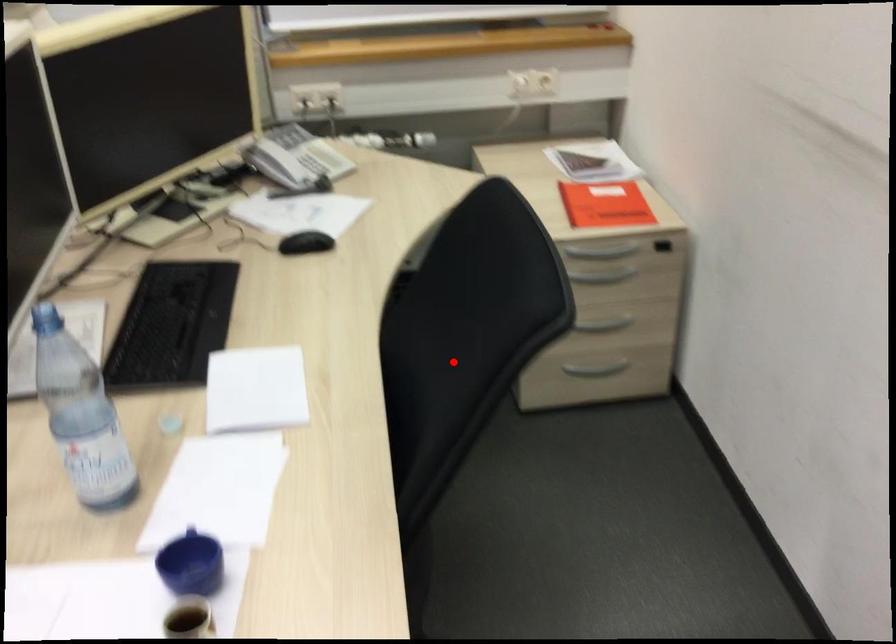
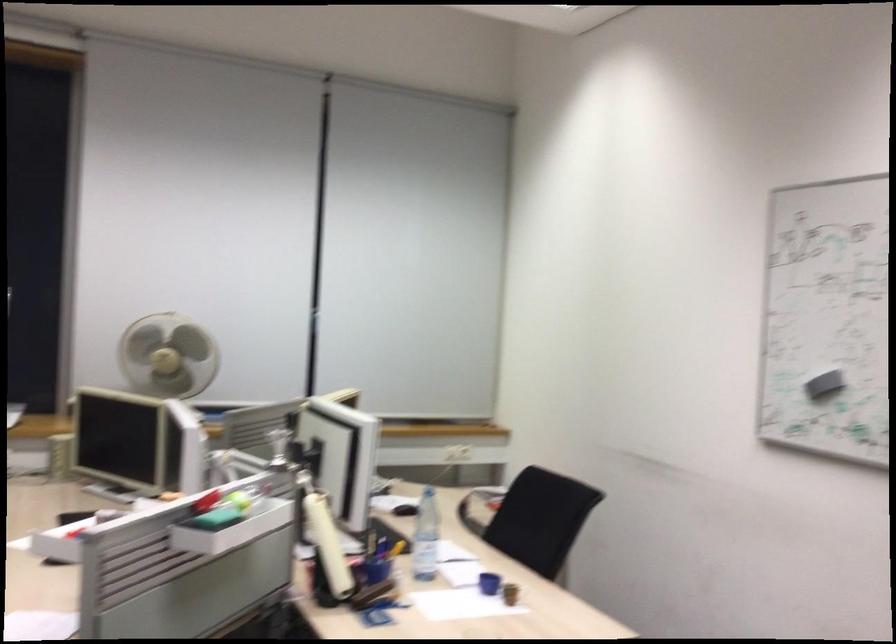
Question: I am providing you with two images of the same scene from different viewpoints. A red point is marked on the first image. Can you still see the location of the red point in image 2?

Choices:
 (A) Yes
 (B) No

Answer: (A)